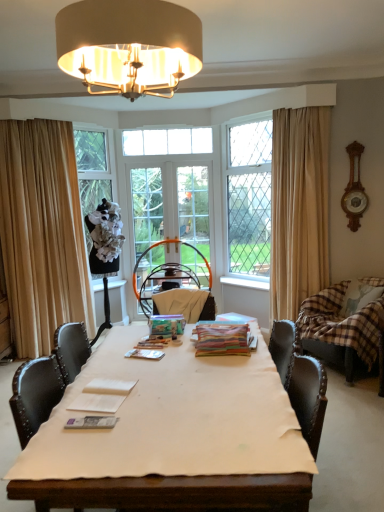
You are a GUI agent. You are given a task and a screenshot of the screen. Output one action in this format:
    pyautogui.click(x=<x>, y=<y>)
    Task: Click on the free space in front of matte white magazine at center, the 3th magazine from the right
    Image resolution: width=384 pixels, height=512 pixels.
    Given the screenshot: What is the action you would take?
    pyautogui.click(x=88, y=449)